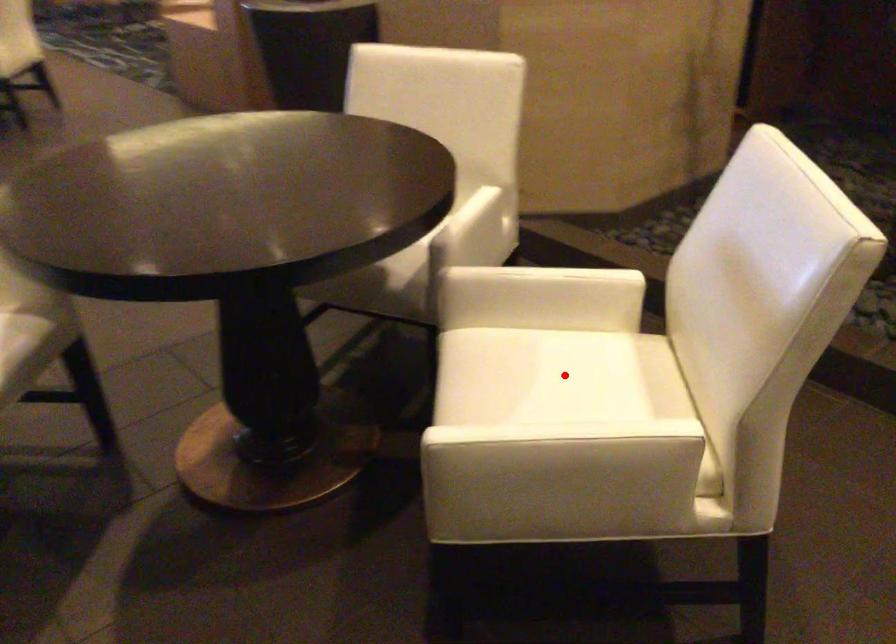
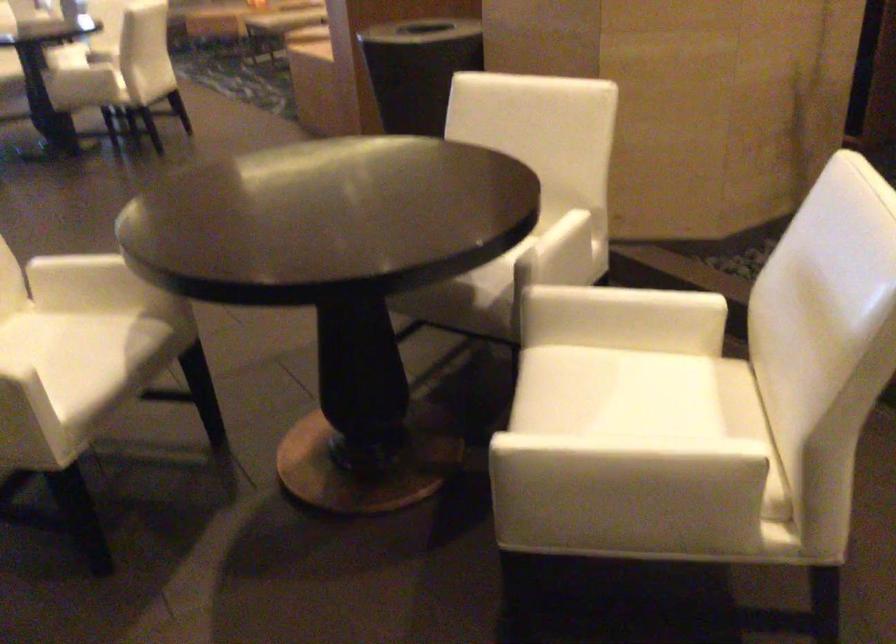
Locate, in the second image, the point that corresponds to the highlighted location in the first image.

(640, 393)